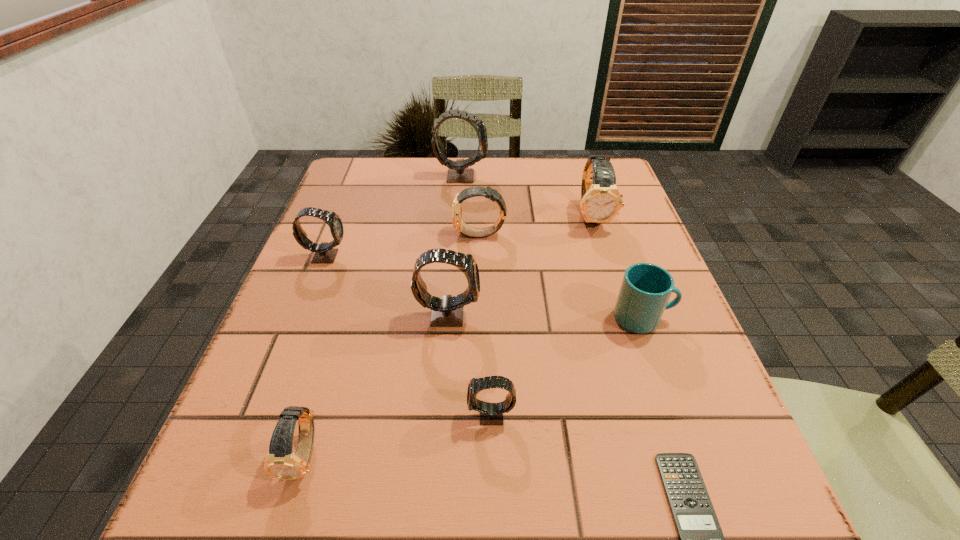
Image resolution: width=960 pixels, height=540 pixels. In order to click on free space located 0.300m on the face of the smallest gray watch in this screenshot , I will do `click(274, 415)`.

Locate an element on the screen. The image size is (960, 540). vacant space situated 0.210m on the face of the smallest gray watch is located at coordinates (332, 415).

You are a GUI agent. You are given a task and a screenshot of the screen. Output one action in this format:
    pyautogui.click(x=<x>, y=<y>)
    Task: Click on the free space located 0.180m on the face of the smallest gray watch
    The height and width of the screenshot is (540, 960).
    Given the screenshot: What is the action you would take?
    pyautogui.click(x=351, y=415)

This screenshot has width=960, height=540. I want to click on vacant area situated on the face of the smallest gold watch, so click(x=283, y=526).

Image resolution: width=960 pixels, height=540 pixels. In order to click on object situated at the near edge in this screenshot , I will do `click(281, 462)`.

Image resolution: width=960 pixels, height=540 pixels. I want to click on watch at the right edge, so click(x=601, y=201).

This screenshot has height=540, width=960. Find the location of `cup that is at the right edge`. cup that is at the right edge is located at coordinates (x=646, y=288).

I want to click on object positioned at the near left corner, so click(x=281, y=462).

The height and width of the screenshot is (540, 960). Identify the location of object present at the far right corner. (601, 201).

What are the coordinates of `free location at the far edge` in the screenshot? It's located at (468, 158).